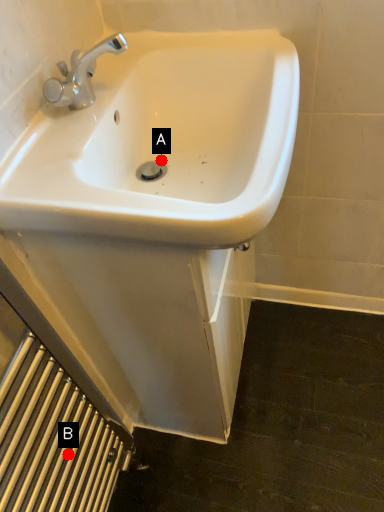
Question: Two points are circled on the image, labeled by A and B beside each circle. Among these points, which one is farthest from the camera?

Choices:
 (A) A is further
 (B) B is further

Answer: (A)